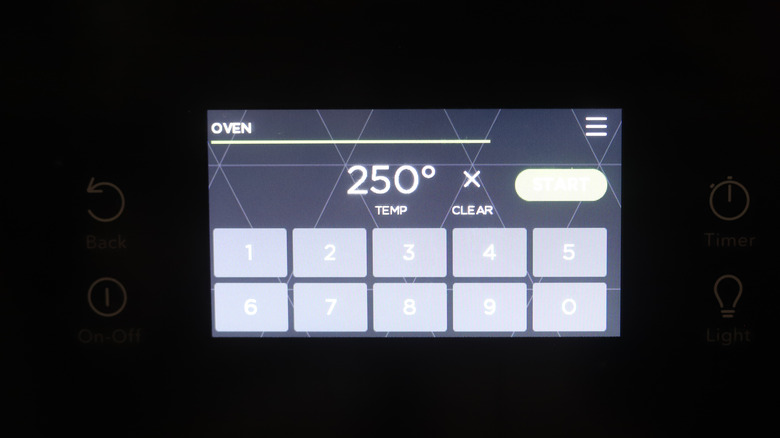
Where is `light button`? This screenshot has width=780, height=438. light button is located at coordinates (736, 302).